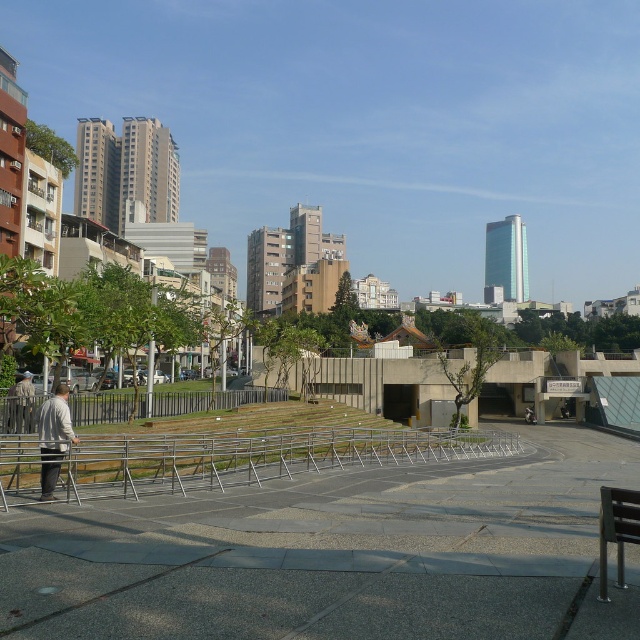
Can you confirm if silver metallic rail at center is positioned to the right of light gray sweater at left?

Correct, you'll find silver metallic rail at center to the right of light gray sweater at left.

Describe the element at coordinates (256, 458) in the screenshot. This screenshot has height=640, width=640. I see `silver metallic rail at center` at that location.

Where is `silver metallic rail at center`? silver metallic rail at center is located at coordinates (256, 458).

Locate an element on the screen. silver metallic rail at center is located at coordinates (256, 458).

I want to click on silver metallic rail at center, so click(x=256, y=458).

Between silver metallic rail at center and light brown leather jacket at lower left, which one appears on the right side from the viewer's perspective?

From the viewer's perspective, silver metallic rail at center appears more on the right side.

The height and width of the screenshot is (640, 640). Identify the location of silver metallic rail at center. (256, 458).

Which of these two, silver metallic rail at center or black metal bench at lower right, stands taller?

silver metallic rail at center

Does silver metallic rail at center have a larger size compared to black metal bench at lower right?

Yes, silver metallic rail at center is bigger than black metal bench at lower right.

What do you see at coordinates (256, 458) in the screenshot?
I see `silver metallic rail at center` at bounding box center [256, 458].

Find the location of a particular element. The height and width of the screenshot is (640, 640). silver metallic rail at center is located at coordinates coord(256,458).